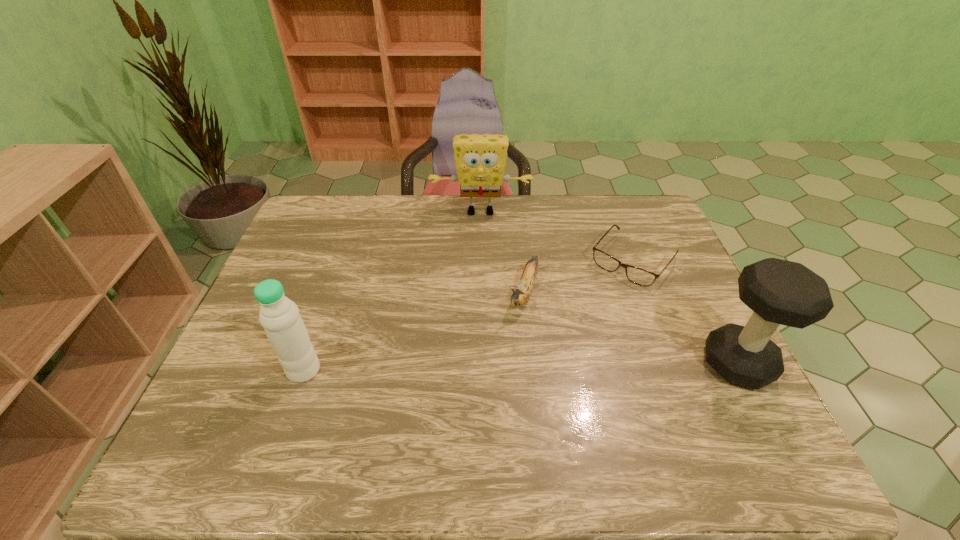
Select which object appears as the closest to the spectacles. Please provide its 2D coordinates. Your answer should be formatted as a tuple, i.e. [(x, y)], where the tuple contains the x and y coordinates of a point satisfying the conditions above.

[(520, 296)]

I want to click on object that is the second nearest to the shortest object, so click(782, 292).

Locate an element on the screen. vacant space that satisfies the following two spatial constraints: 1. on the back side of the spectacles; 2. on the right side of the fourth tallest object is located at coordinates (519, 260).